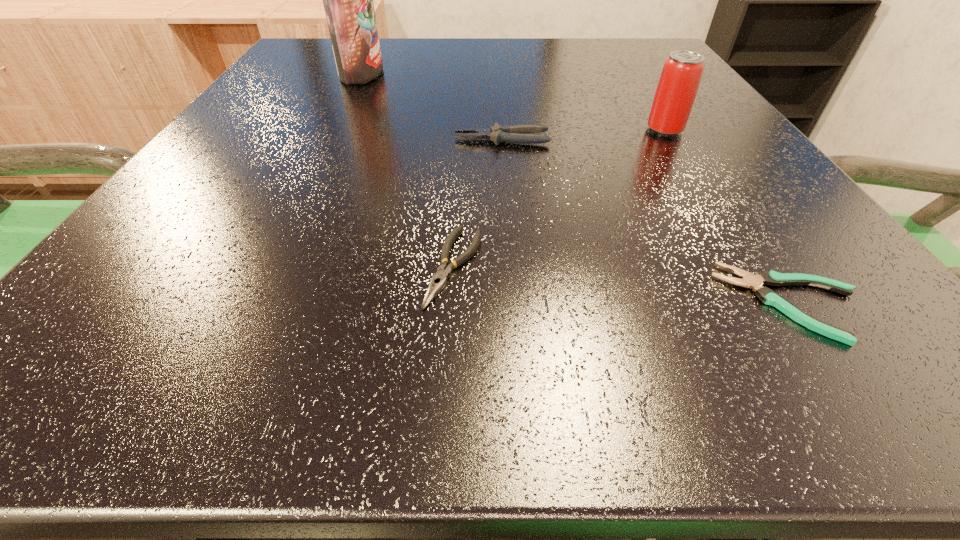
Where is `unoccupied position between the second shortest pliers and the third shortest object`? This screenshot has width=960, height=540. unoccupied position between the second shortest pliers and the third shortest object is located at coordinates (478, 203).

Locate an element on the screen. vacant space in between the shortest pliers and the tallest object is located at coordinates (576, 187).

Find the location of a particular element. vacant space in between the shortest object and the third tallest object is located at coordinates tap(647, 221).

Identify the location of free space between the shortest pliers and the beer can. (728, 216).

You are a GUI agent. You are given a task and a screenshot of the screen. Output one action in this format:
    pyautogui.click(x=<x>, y=<y>)
    Task: Click on the free space between the fourth shortest object and the shortest object
    This screenshot has height=540, width=960.
    Given the screenshot: What is the action you would take?
    pyautogui.click(x=728, y=216)

This screenshot has height=540, width=960. What are the coordinates of `vacant area that lies between the farthest object and the second shortest object` in the screenshot? It's located at (408, 170).

Locate an element on the screen. The width and height of the screenshot is (960, 540). object that is the second closest to the second shortest object is located at coordinates (769, 297).

Identify which object is located as the third nearest to the tallest pliers. Please provide its 2D coordinates. Your answer should be formatted as a tuple, i.e. [(x, y)], where the tuple contains the x and y coordinates of a point satisfying the conditions above.

[(348, 0)]

Select which pliers appears as the second closest to the leftmost object. Please provide its 2D coordinates. Your answer should be formatted as a tuple, i.e. [(x, y)], where the tuple contains the x and y coordinates of a point satisfying the conditions above.

[(438, 281)]

Image resolution: width=960 pixels, height=540 pixels. Identify the location of the second closest pliers to the beer can. (769, 297).